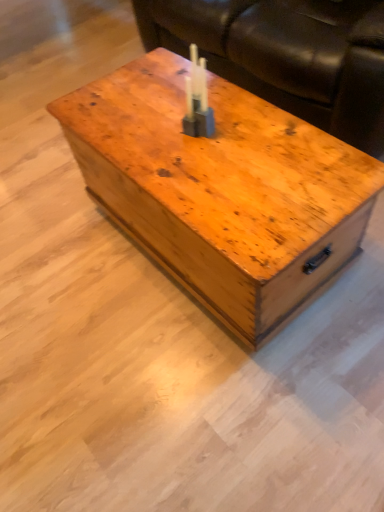
Question: From the image's perspective, would you say wooden chest at center is positioned over brown leather couch at upper center?

Choices:
 (A) yes
 (B) no

Answer: (B)

Question: Does wooden chest at center contain brown leather couch at upper center?

Choices:
 (A) yes
 (B) no

Answer: (B)

Question: From the image's perspective, does wooden chest at center appear lower than brown leather couch at upper center?

Choices:
 (A) no
 (B) yes

Answer: (B)

Question: From a real-world perspective, is wooden chest at center positioned under brown leather couch at upper center based on gravity?

Choices:
 (A) yes
 (B) no

Answer: (A)

Question: Is wooden chest at center positioned before brown leather couch at upper center?

Choices:
 (A) yes
 (B) no

Answer: (A)

Question: From the image's perspective, is translucent plastic candle at center above or below wooden chest at center?

Choices:
 (A) below
 (B) above

Answer: (B)

Question: Is translucent plastic candle at center wider or thinner than wooden chest at center?

Choices:
 (A) wide
 (B) thin

Answer: (B)

Question: Choose the correct answer: Is translucent plastic candle at center inside wooden chest at center or outside it?

Choices:
 (A) outside
 (B) inside

Answer: (A)

Question: In the image, is translucent plastic candle at center positioned in front of or behind wooden chest at center?

Choices:
 (A) behind
 (B) front

Answer: (A)

Question: Is point (233, 45) positioned closer to the camera than point (329, 279)?

Choices:
 (A) closer
 (B) farther

Answer: (B)

Question: From a real-world perspective, is brown leather couch at upper center positioned above or below wooden chest at center?

Choices:
 (A) below
 (B) above

Answer: (B)

Question: Considering the positions of brown leather couch at upper center and wooden chest at center in the image, is brown leather couch at upper center bigger or smaller than wooden chest at center?

Choices:
 (A) small
 (B) big

Answer: (B)

Question: Based on their positions, is brown leather couch at upper center located to the left or right of wooden chest at center?

Choices:
 (A) left
 (B) right

Answer: (B)

Question: Is wooden chest at center inside the boundaries of translucent plastic candle at center, or outside?

Choices:
 (A) inside
 (B) outside

Answer: (B)

Question: Considering the positions of wooden chest at center and translucent plastic candle at center in the image, is wooden chest at center bigger or smaller than translucent plastic candle at center?

Choices:
 (A) small
 (B) big

Answer: (B)